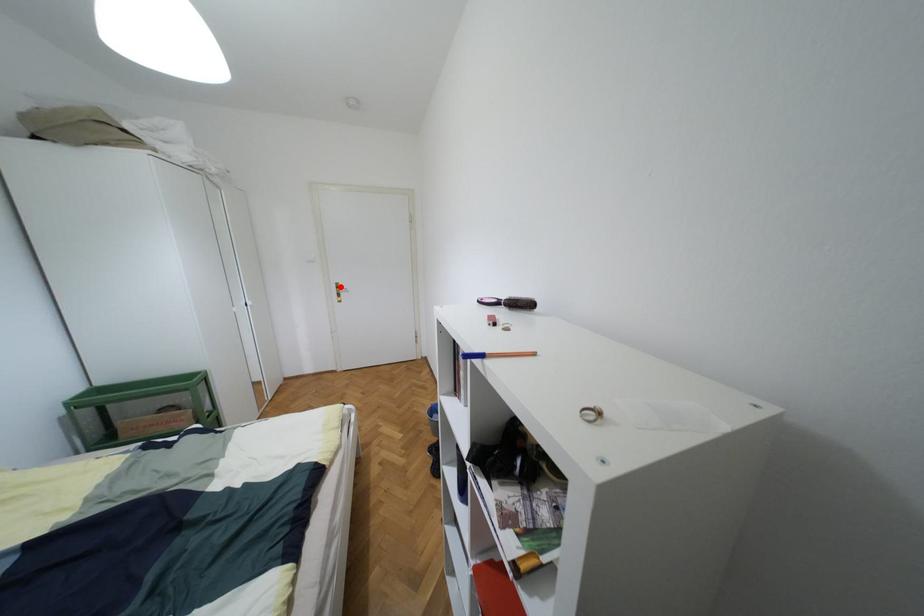
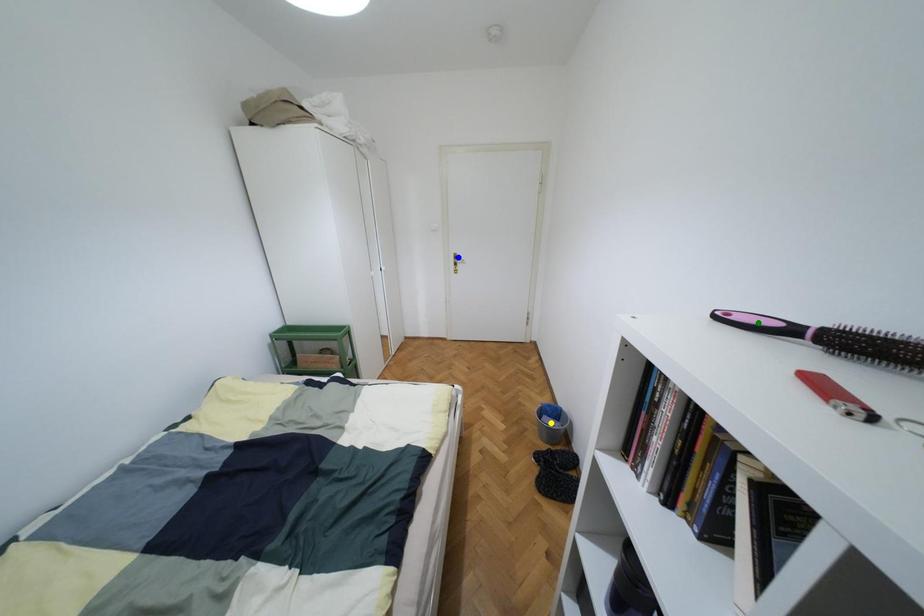
Question: I am providing you with two images of the same scene from different viewpoints. A red point is marked on the first image. You are given multiple points on the second image. Which point in image 2 is actually the same real-world point as the red point in image 1?

Choices:
 (A) green point
 (B) blue point
 (C) yellow point

Answer: (B)